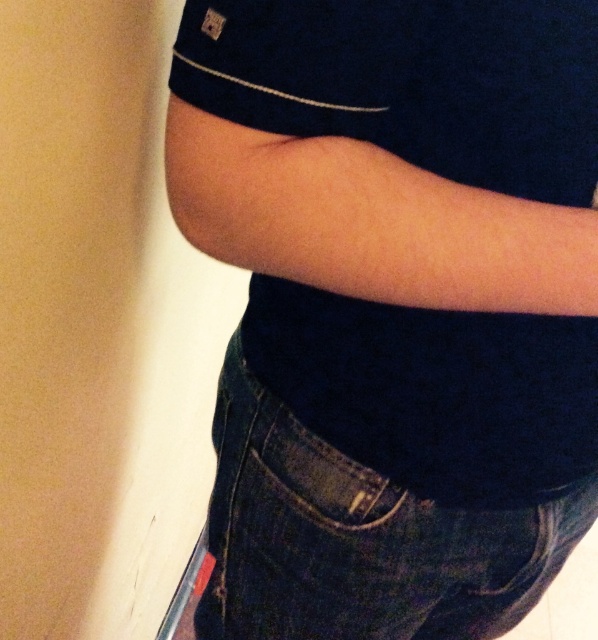
Question: Which point is closer to the camera?

Choices:
 (A) (251, 566)
 (B) (321, 488)

Answer: (B)

Question: Is dark blue cotton shirt at center positioned behind dark blue denim jeans at lower center?

Choices:
 (A) yes
 (B) no

Answer: (B)

Question: Is dark blue cotton shirt at center to the right of dark blue denim jeans at lower center from the viewer's perspective?

Choices:
 (A) yes
 (B) no

Answer: (B)

Question: Which of the following is the farthest from the observer?

Choices:
 (A) dark blue cotton shirt at center
 (B) dark blue denim jeans at lower center

Answer: (B)

Question: Is dark blue cotton shirt at center to the right of dark blue denim jeans at lower center from the viewer's perspective?

Choices:
 (A) no
 (B) yes

Answer: (A)

Question: Which object appears farthest from the camera in this image?

Choices:
 (A) dark blue cotton shirt at center
 (B) dark blue denim jeans at lower center

Answer: (B)